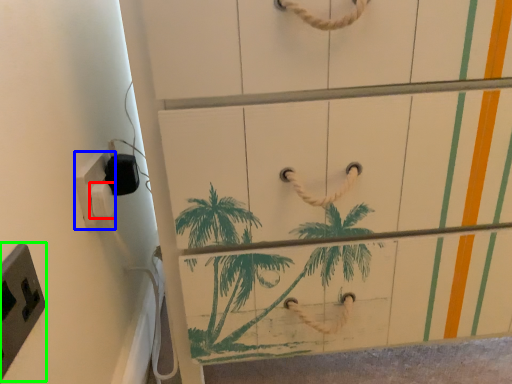
Question: Estimate the real-world distances between objects in this image. Which object is closer to light switch (highlighted by a red box), light switch (highlighted by a blue box) or light switch (highlighted by a green box)?

Choices:
 (A) light switch
 (B) light switch

Answer: (A)